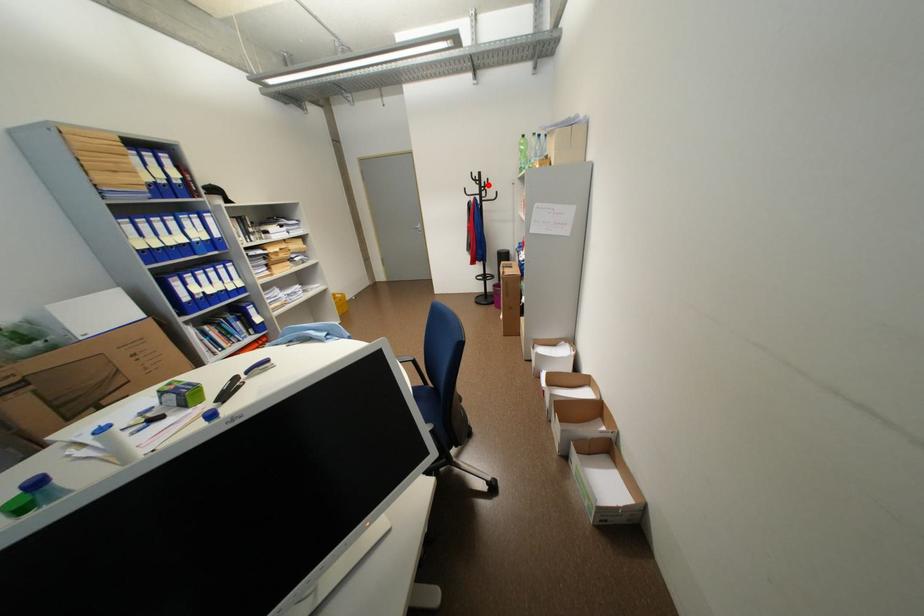
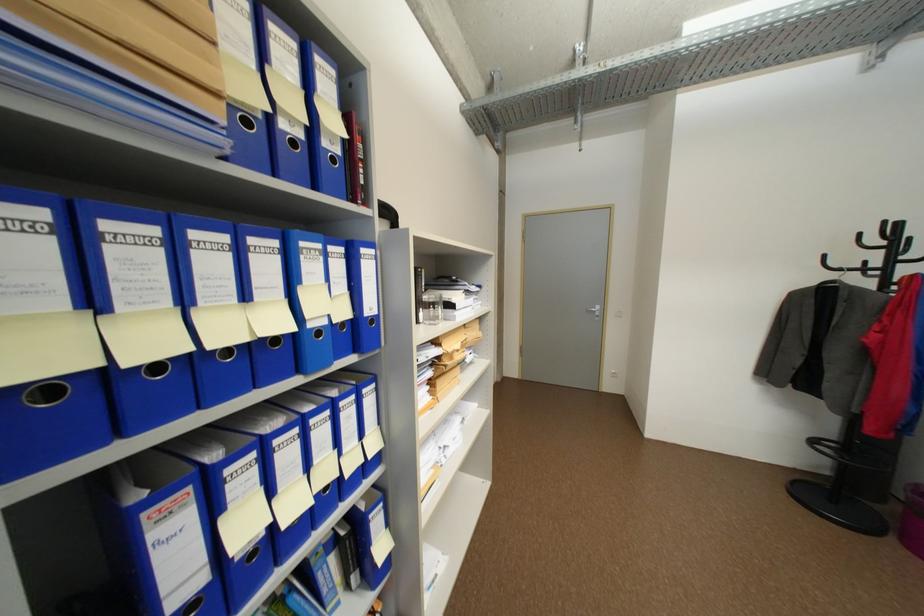
Find the pixel in the second image that matches the highlighted location in the first image.

(902, 248)